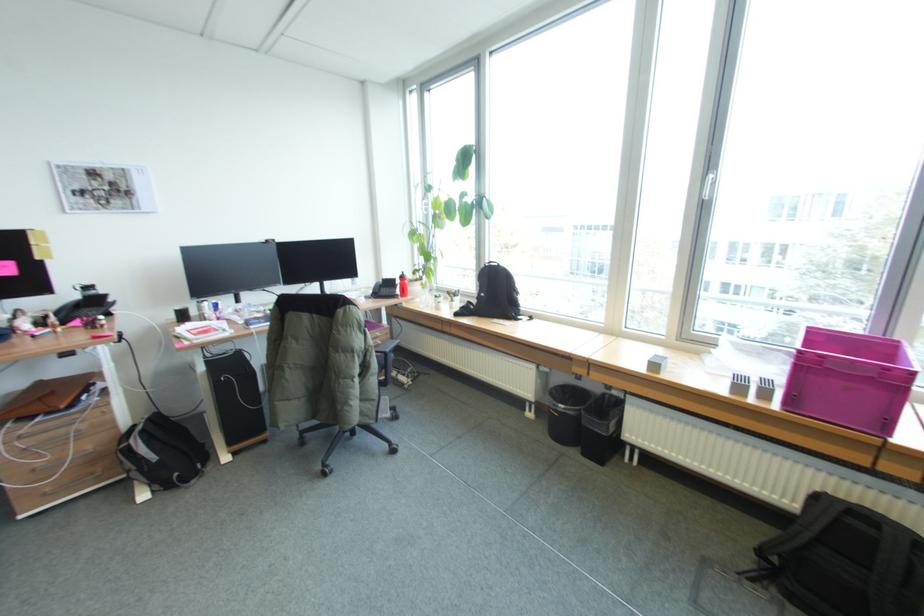
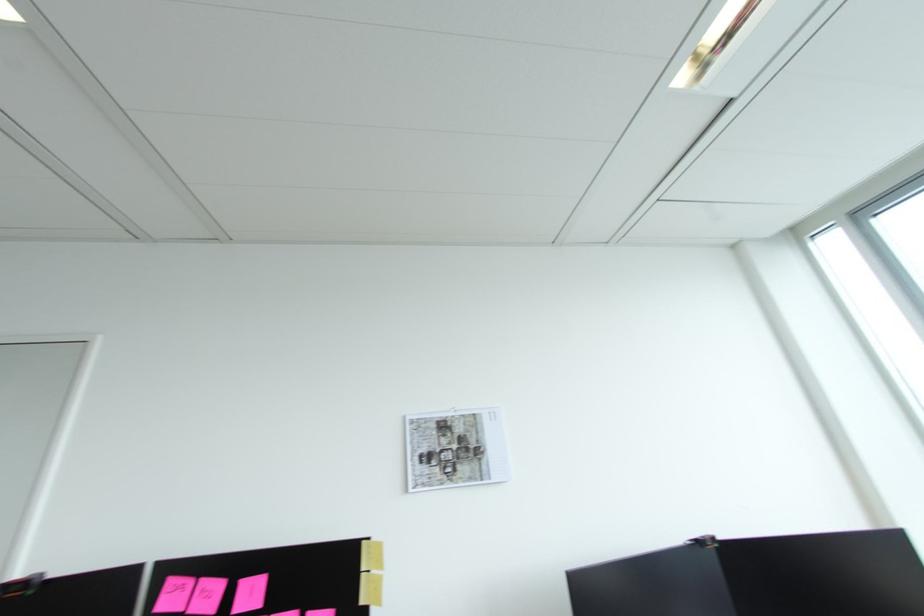
In the second image, find the point that corresponds to (110,187) in the first image.

(459, 446)